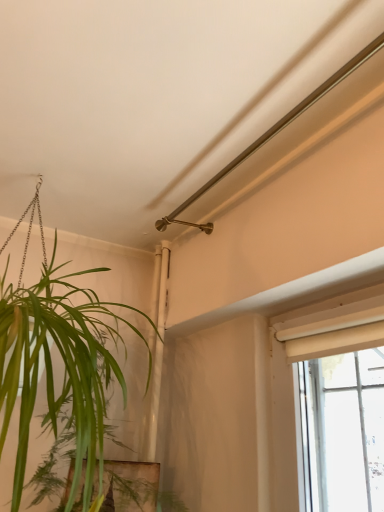
I want to click on green leafy plant at upper left, so click(63, 362).

Image resolution: width=384 pixels, height=512 pixels. What do you see at coordinates (63, 362) in the screenshot? I see `green leafy plant at upper left` at bounding box center [63, 362].

You are a GUI agent. You are given a task and a screenshot of the screen. Output one action in this format:
    pyautogui.click(x=<x>, y=<y>)
    Task: Click on the green leafy plant at upper left
    The height and width of the screenshot is (512, 384).
    Given the screenshot: What is the action you would take?
    pyautogui.click(x=63, y=362)